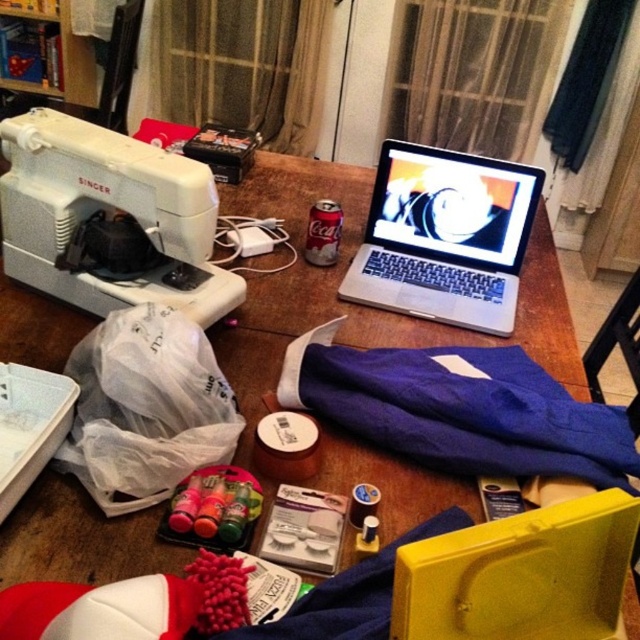
Which is more to the left, purple fabric at center or white plastic sewing machine at left?

From the viewer's perspective, white plastic sewing machine at left appears more on the left side.

Does purple fabric at center appear over white plastic sewing machine at left?

No, purple fabric at center is not above white plastic sewing machine at left.

This screenshot has width=640, height=640. Describe the element at coordinates (460, 410) in the screenshot. I see `purple fabric at center` at that location.

I want to click on purple fabric at center, so click(x=460, y=410).

How distant is white plastic sewing machine at left from silver metallic laptop at upper center?

They are 19.55 inches apart.

Who is lower down, white plastic sewing machine at left or silver metallic laptop at upper center?

Positioned lower is silver metallic laptop at upper center.

Describe the element at coordinates (106, 209) in the screenshot. This screenshot has width=640, height=640. I see `white plastic sewing machine at left` at that location.

At what (x,y) coordinates should I click in order to perform the action: click on white plastic sewing machine at left. Please return your answer as a coordinate pair (x, y). The width and height of the screenshot is (640, 640). Looking at the image, I should click on (106, 209).

At what (x,y) coordinates should I click in order to perform the action: click on purple fabric at center. Please return your answer as a coordinate pair (x, y). The image size is (640, 640). Looking at the image, I should click on (460, 410).

Is purple fabric at center wider than silver metallic laptop at upper center?

Indeed, purple fabric at center has a greater width compared to silver metallic laptop at upper center.

Who is more distant from viewer, (579,410) or (412,292)?

The point (412,292) is behind.

At what (x,y) coordinates should I click in order to perform the action: click on purple fabric at center. Please return your answer as a coordinate pair (x, y). The height and width of the screenshot is (640, 640). Looking at the image, I should click on (460, 410).